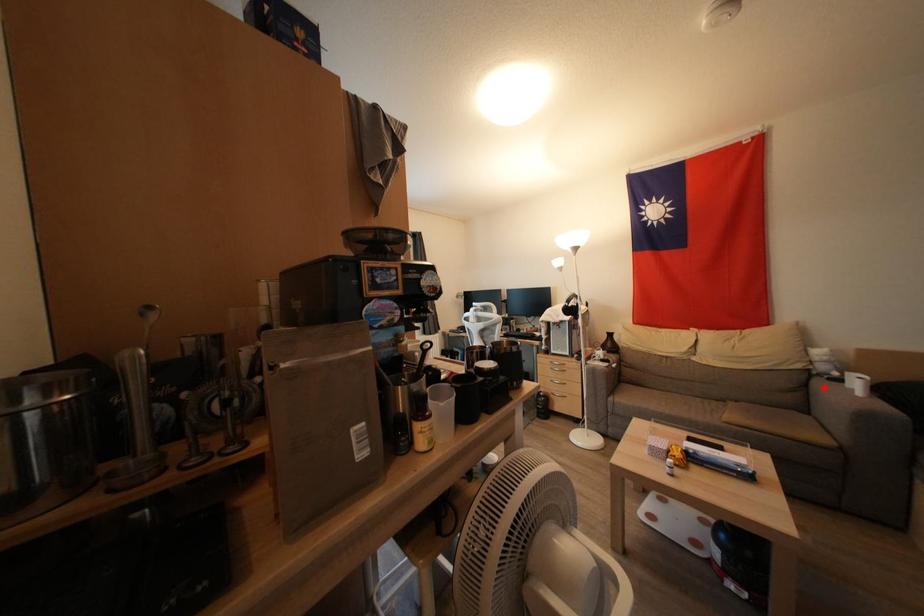
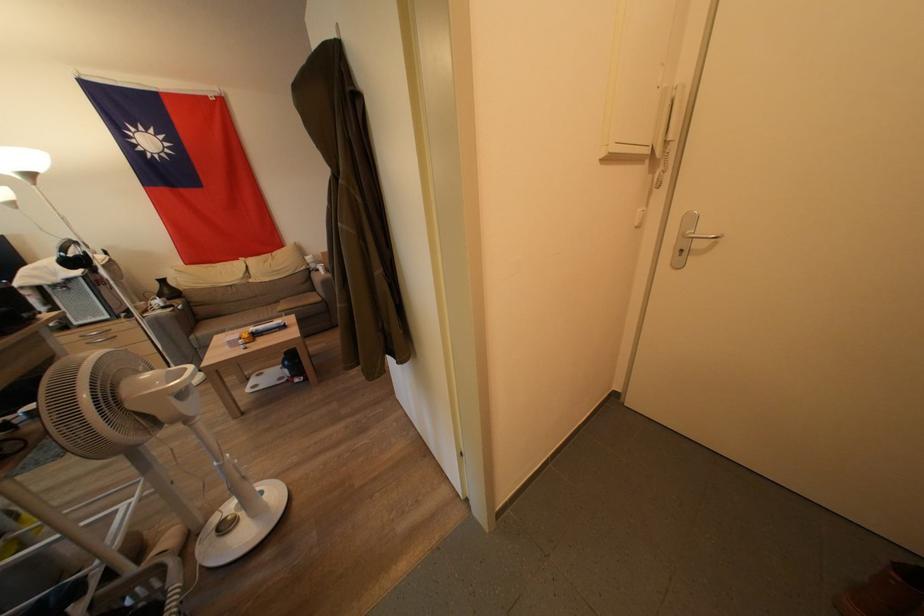
Question: I am providing you with two images of the same scene from different viewpoints. Image1 has a red point marked. In image2, the corresponding 3D location appears at what relative position? Reply with the corresponding letter.

Choices:
 (A) Closer
 (B) Farther

Answer: (B)